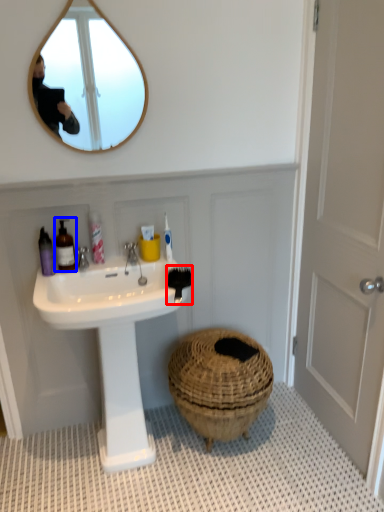
Question: Which object is further to the camera taking this photo, brush (highlighted by a red box) or toiletry (highlighted by a blue box)?

Choices:
 (A) brush
 (B) toiletry

Answer: (B)